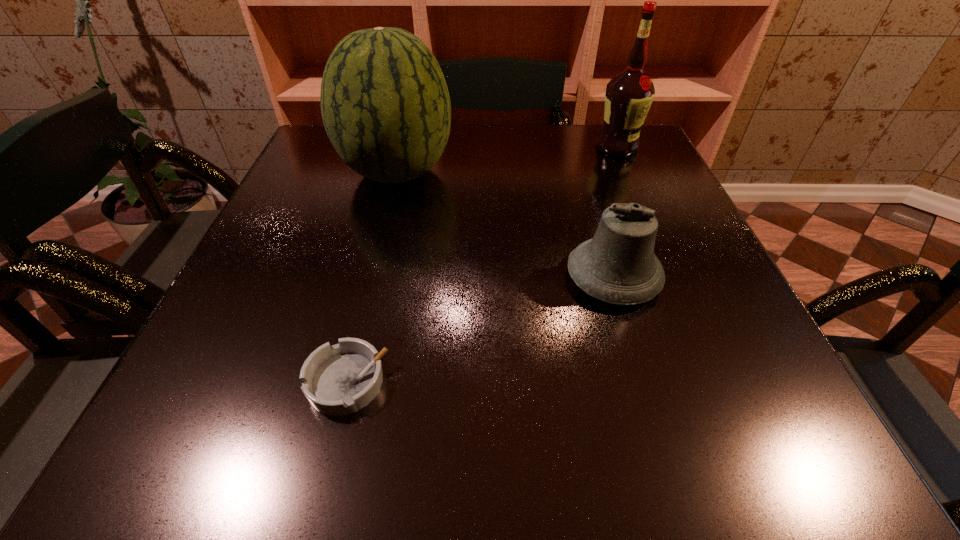
The width and height of the screenshot is (960, 540). In order to click on alcohol in this screenshot , I will do `click(629, 95)`.

Where is `watermelon`? This screenshot has width=960, height=540. watermelon is located at coordinates (385, 105).

At what (x,y) coordinates should I click in order to perform the action: click on the third tallest object. Please return your answer as a coordinate pair (x, y). The width and height of the screenshot is (960, 540). Looking at the image, I should click on (618, 265).

Find the location of a particular element. the second nearest object is located at coordinates (618, 265).

I want to click on the nearest object, so click(x=341, y=379).

Identify the location of the shortest object. (341, 379).

Locate an element on the screen. This screenshot has height=540, width=960. free space located on the label of the alcohol is located at coordinates (630, 176).

The width and height of the screenshot is (960, 540). I want to click on vacant space situated 0.070m on the left of the watermelon, so click(x=310, y=172).

You are a GUI agent. You are given a task and a screenshot of the screen. Output one action in this format:
    pyautogui.click(x=<x>, y=<y>)
    Task: Click on the vacant space situated 0.380m on the back of the bell
    The width and height of the screenshot is (960, 540).
    Given the screenshot: What is the action you would take?
    pyautogui.click(x=574, y=148)

Locate an element on the screen. free space located 0.130m on the left of the nearest object is located at coordinates (217, 382).